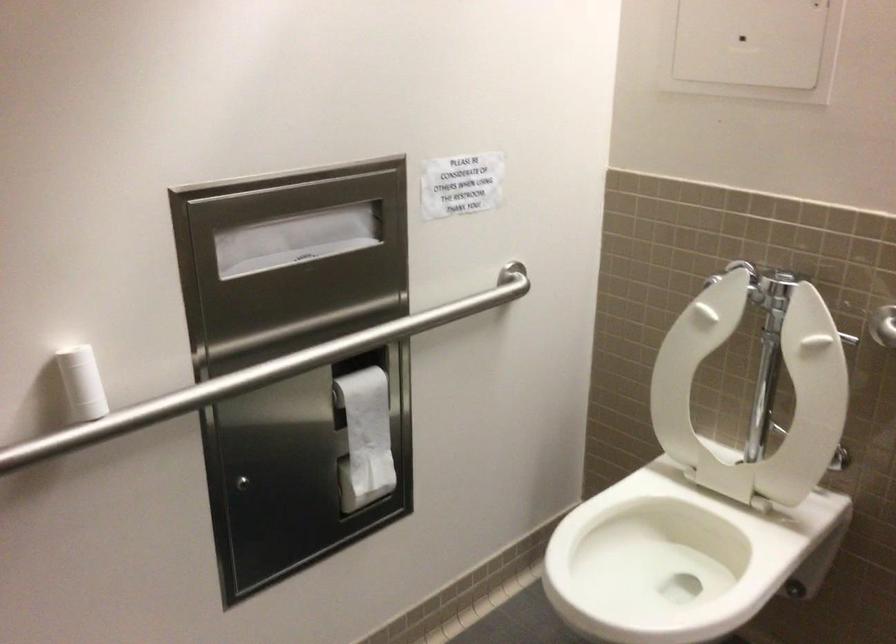
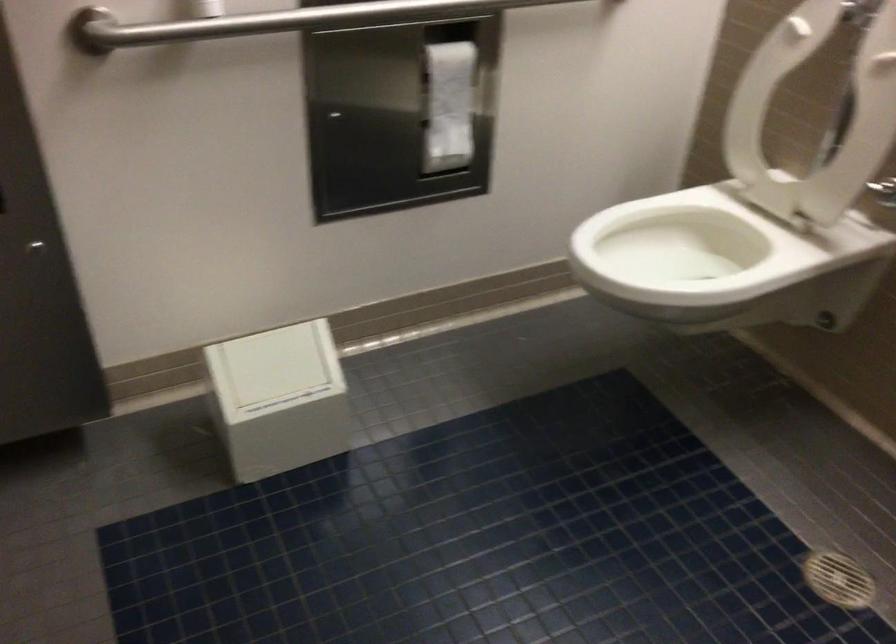
In the second image, find the point that corresponds to (728,384) in the first image.

(814, 115)